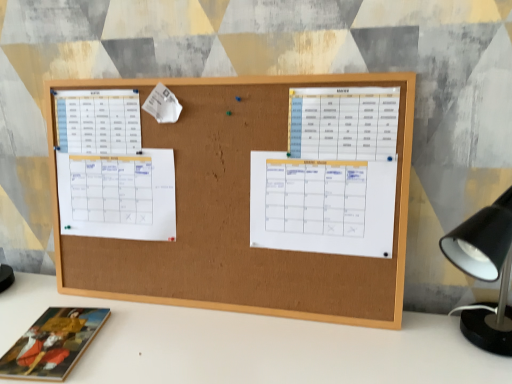
Question: Is white paper calendar at center, arranged as the 1th list when viewed from the right, with white paper calendar at center, marked as the second list in a right-to-left arrangement?

Choices:
 (A) yes
 (B) no

Answer: (A)

Question: Can you confirm if white paper calendar at center, arranged as the 1th list when viewed from the right, is positioned to the right of white paper calendar at center, positioned as the third list in left-to-right order?

Choices:
 (A) yes
 (B) no

Answer: (A)

Question: Does white paper calendar at center, which ranks as the 4th list in left-to-right order, have a greater height compared to white paper calendar at center, marked as the second list in a right-to-left arrangement?

Choices:
 (A) yes
 (B) no

Answer: (B)

Question: From a real-world perspective, is white paper calendar at center, arranged as the 1th list when viewed from the right, on white paper calendar at center, marked as the second list in a right-to-left arrangement?

Choices:
 (A) yes
 (B) no

Answer: (A)

Question: Considering the relative positions of white paper calendar at center, which ranks as the 4th list in left-to-right order, and white paper calendar at center, marked as the second list in a right-to-left arrangement, in the image provided, is white paper calendar at center, which ranks as the 4th list in left-to-right order, to the left of white paper calendar at center, marked as the second list in a right-to-left arrangement, from the viewer's perspective?

Choices:
 (A) no
 (B) yes

Answer: (A)

Question: Is white paper calendar at center, which ranks as the 4th list in left-to-right order, positioned before white paper calendar at center, marked as the second list in a right-to-left arrangement?

Choices:
 (A) yes
 (B) no

Answer: (A)

Question: Can you confirm if corkboard at center is taller than white paper at left, which is counted as the fourth list, starting from the right?

Choices:
 (A) no
 (B) yes

Answer: (B)

Question: From the image's perspective, is corkboard at center above white paper at left, which ranks as the first list in left-to-right order?

Choices:
 (A) yes
 (B) no

Answer: (B)

Question: Is corkboard at center next to white paper at left, which ranks as the first list in left-to-right order?

Choices:
 (A) no
 (B) yes

Answer: (A)

Question: From a real-world perspective, is corkboard at center on white paper at left, which is counted as the fourth list, starting from the right?

Choices:
 (A) no
 (B) yes

Answer: (A)

Question: Can we say corkboard at center lies outside white paper at left, which ranks as the first list in left-to-right order?

Choices:
 (A) yes
 (B) no

Answer: (A)

Question: Does corkboard at center have a larger size compared to white paper at left, which ranks as the first list in left-to-right order?

Choices:
 (A) no
 (B) yes

Answer: (B)

Question: Is white paper calendar at center, which ranks as the 4th list in left-to-right order, thinner than white paper calendar at left, the third list when ordered from right to left?

Choices:
 (A) no
 (B) yes

Answer: (B)